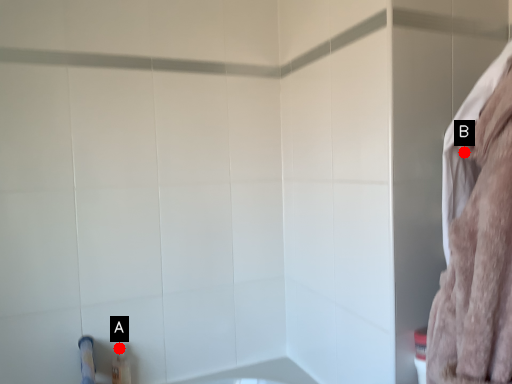
Question: Two points are circled on the image, labeled by A and B beside each circle. Which of the following is the farthest from the observer?

Choices:
 (A) A is further
 (B) B is further

Answer: (A)